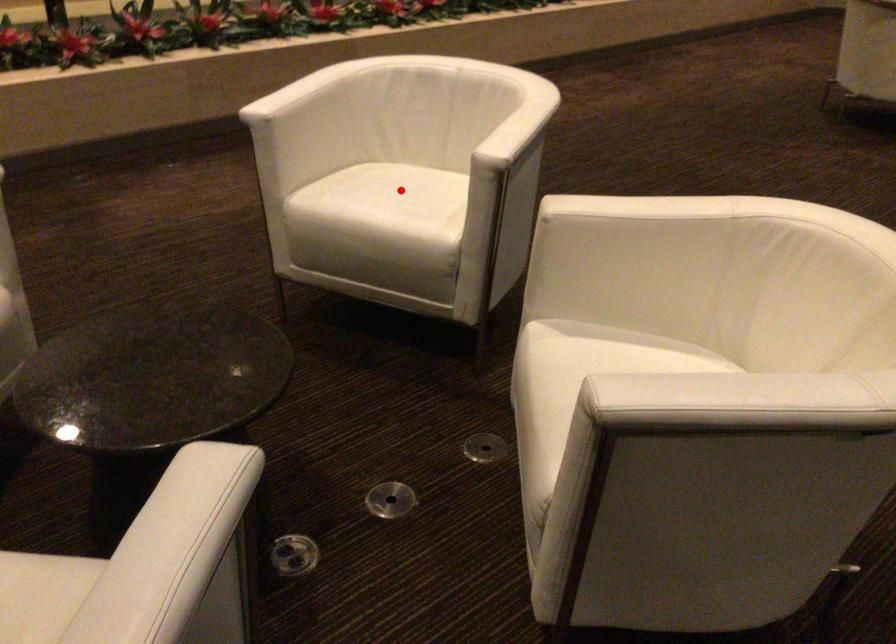
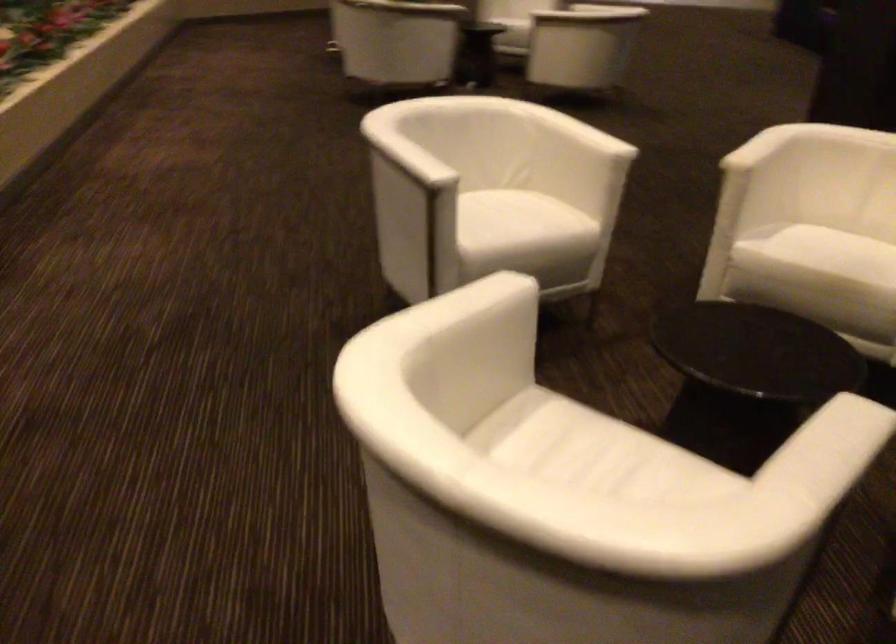
In the second image, find the point that corresponds to the highlighted location in the first image.

(502, 214)